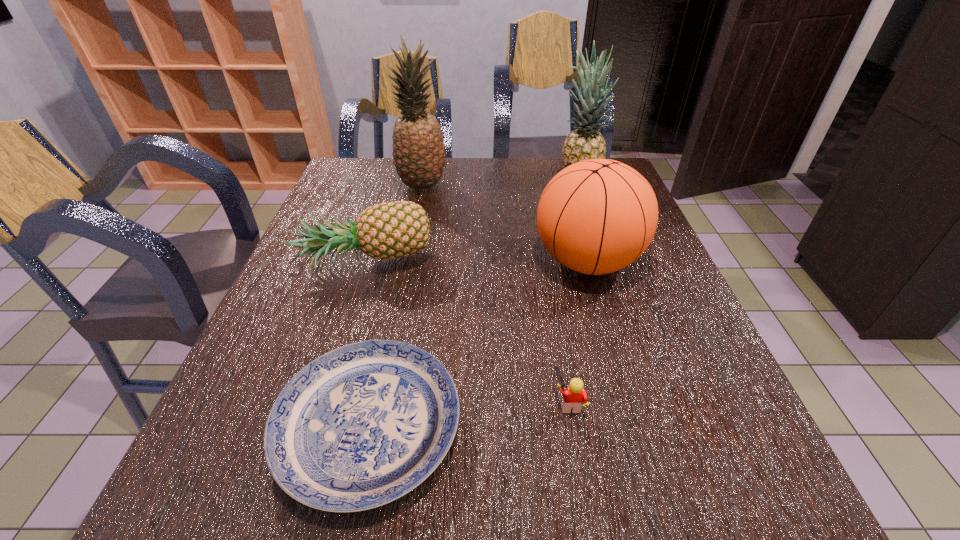
Locate an element on the screen. This screenshot has height=540, width=960. empty location between the fifth tallest object and the shortest object is located at coordinates (468, 414).

Identify which object is located as the third nearest to the fifth tallest object. Please provide its 2D coordinates. Your answer should be formatted as a tuple, i.e. [(x, y)], where the tuple contains the x and y coordinates of a point satisfying the conditions above.

[(389, 230)]

Locate an element on the screen. The width and height of the screenshot is (960, 540). object that is the second nearest to the fifth tallest object is located at coordinates (597, 216).

Locate an element on the screen. The height and width of the screenshot is (540, 960). pineapple that can be found as the second closest to the rightmost pineapple is located at coordinates (389, 230).

The height and width of the screenshot is (540, 960). I want to click on pineapple that is the nearest to the shortest pineapple, so click(418, 146).

The image size is (960, 540). Identify the location of free space that satisfies the following two spatial constraints: 1. on the front side of the rightmost pineapple; 2. in front of the Lego with the accessory visible. (655, 402).